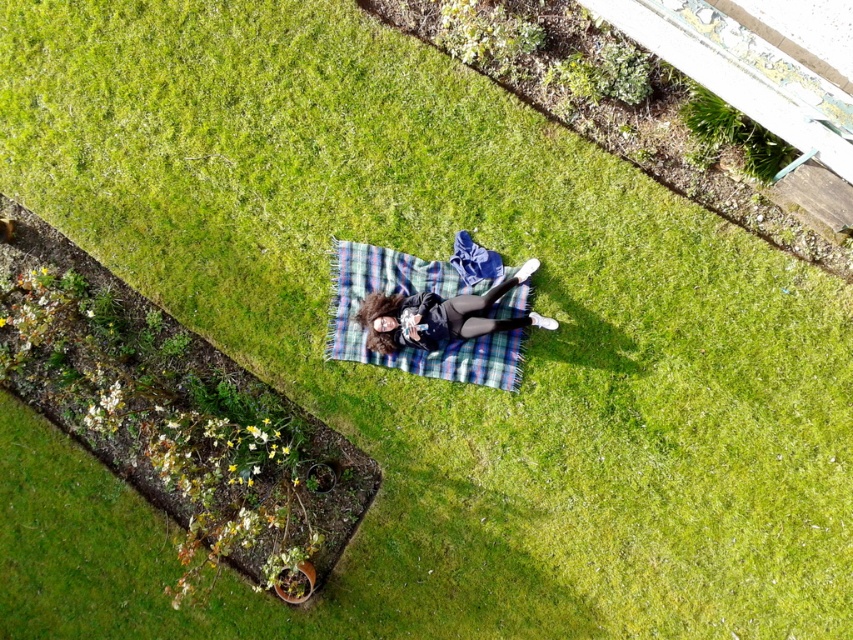
You are standing at the edge of the grassy area and want to place a small flag at the point closer to you between point (486, 364) and point (492, 296). Which point should you choose?

Point (486, 364) is closer to you because it is further to the viewer than point (492, 296).